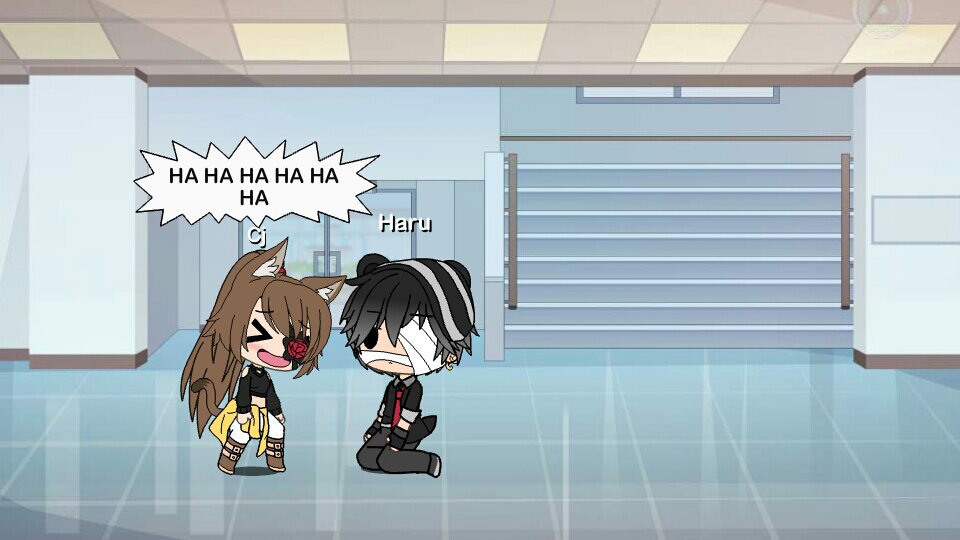
Image resolution: width=960 pixels, height=540 pixels. I want to click on wall, so click(x=905, y=282).